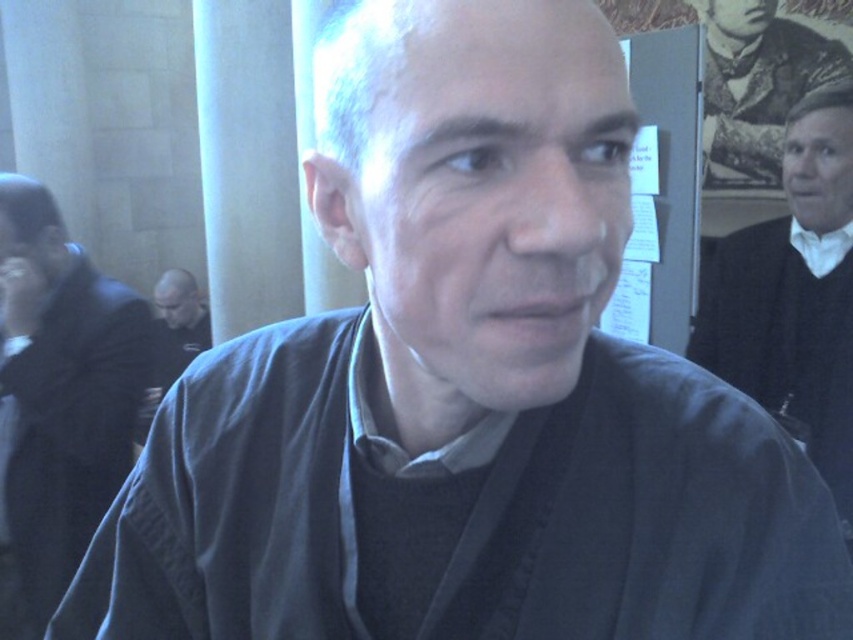
You are a tailor measuring the distance between two fabrics for a custom suit. The dark blue fabric at center and the dark gray fabric at center are part of your inventory. Can you fit a 1 meter long measuring tape between them without bending it?

The dark blue fabric at center and dark gray fabric at center are 1.27 meters apart, so yes, the 1 meter long measuring tape can fit between them without bending since the distance is greater than the tape length.

What is the color of the fabric located at the coordinates point (646, 518)?

The dark blue fabric at center is represented by point (646, 518).

You are a tailor examining a mannequin dressed in two fabrics. The dark blue fabric at center is part of the shirt, and the dark gray fabric at center is part of the jacket. Which fabric is closer to the ground?

The dark blue fabric at center is below the dark gray fabric at center, so the dark blue fabric at center is closer to the ground.